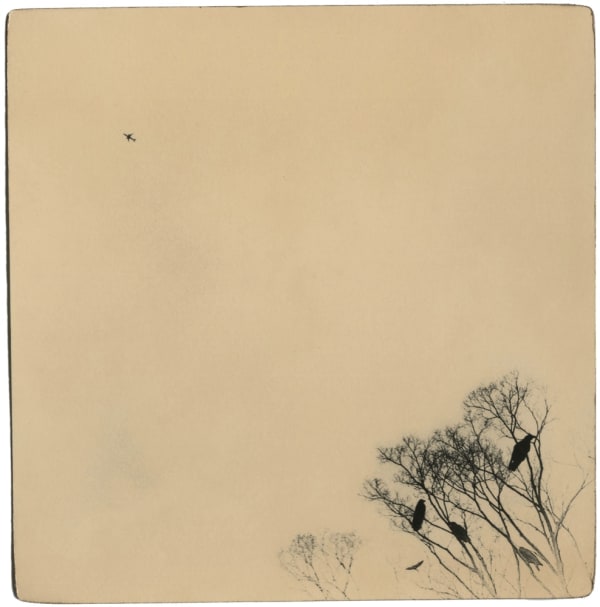
I want to click on corner, so click(538, 46), click(69, 572), click(42, 36), click(572, 572).